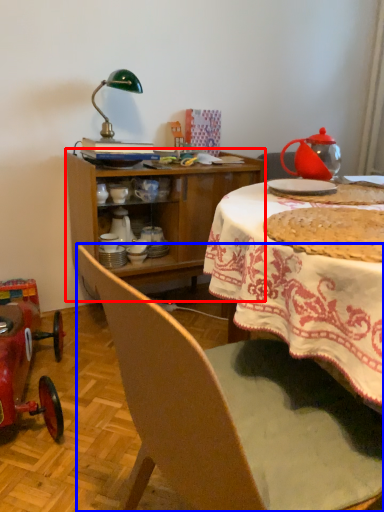
Question: Which object appears farthest to the camera in this image, cabinetry (highlighted by a red box) or chair (highlighted by a blue box)?

Choices:
 (A) cabinetry
 (B) chair

Answer: (A)